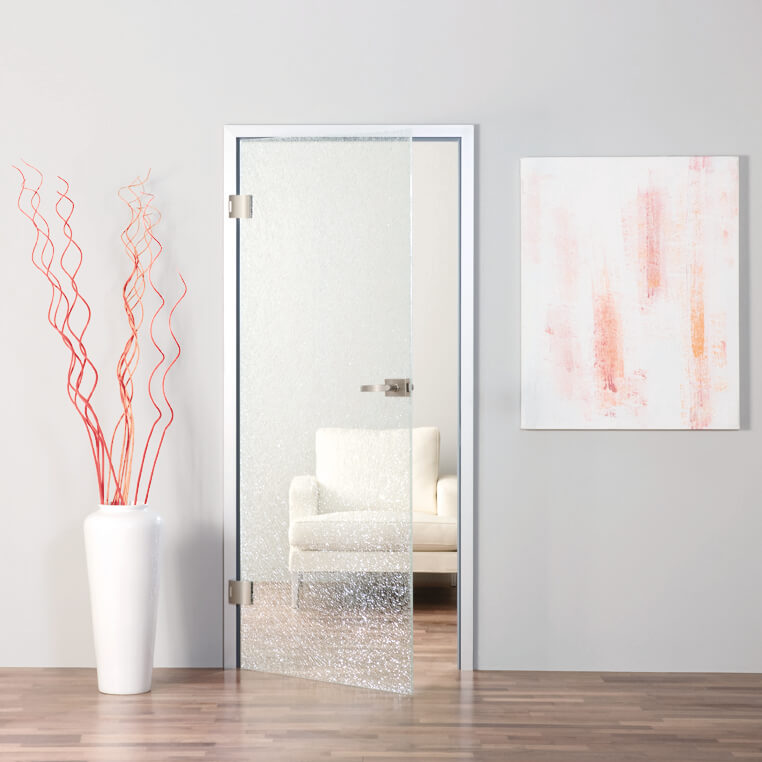
This screenshot has height=762, width=762. Find the location of `door frame`. door frame is located at coordinates (476, 186), (213, 389).